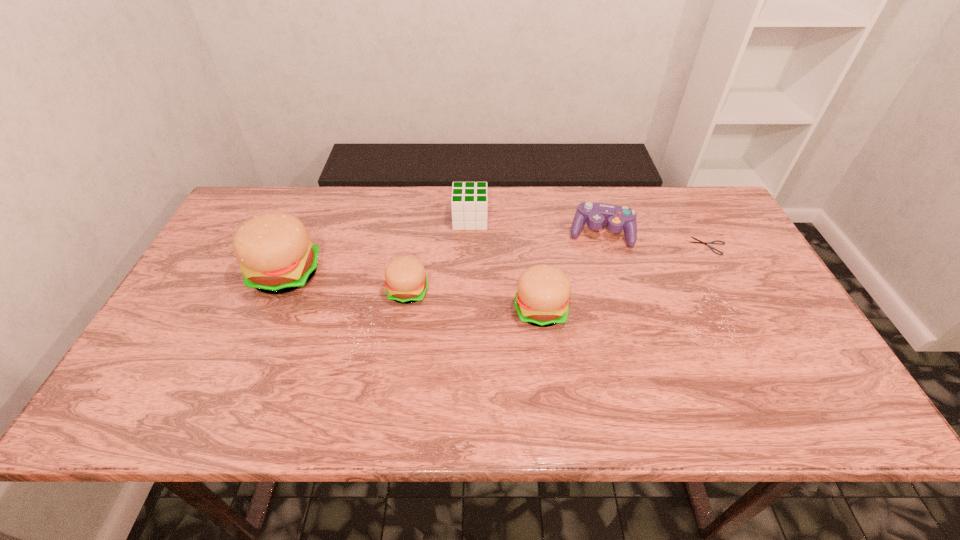
The image size is (960, 540). I want to click on the leftmost object, so pos(276,255).

Find the location of `the tallest hamburger`. the tallest hamburger is located at coordinates (276, 255).

The width and height of the screenshot is (960, 540). I want to click on the shortest hamburger, so click(x=405, y=278).

The image size is (960, 540). I want to click on the second object from left to right, so click(x=405, y=278).

Locate an element on the screen. the second shortest hamburger is located at coordinates (542, 299).

Locate an element on the screen. The width and height of the screenshot is (960, 540). the fourth object from left to right is located at coordinates (542, 299).

Identify the location of the shortest object. Image resolution: width=960 pixels, height=540 pixels. (701, 242).

Find the location of a particular element. Image resolution: width=960 pixels, height=540 pixels. shears is located at coordinates point(701,242).

Find the location of a particular element. This screenshot has width=960, height=540. control is located at coordinates (615, 218).

At what (x,y) coordinates should I click in order to perform the action: click on the fourth object from right to left. Please return your answer as a coordinate pair (x, y). The image size is (960, 540). Looking at the image, I should click on (469, 203).